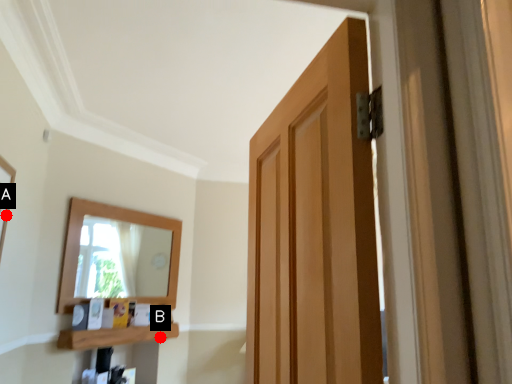
Question: Two points are circled on the image, labeled by A and B beside each circle. Which point appears farthest from the camera in this image?

Choices:
 (A) A is further
 (B) B is further

Answer: (B)